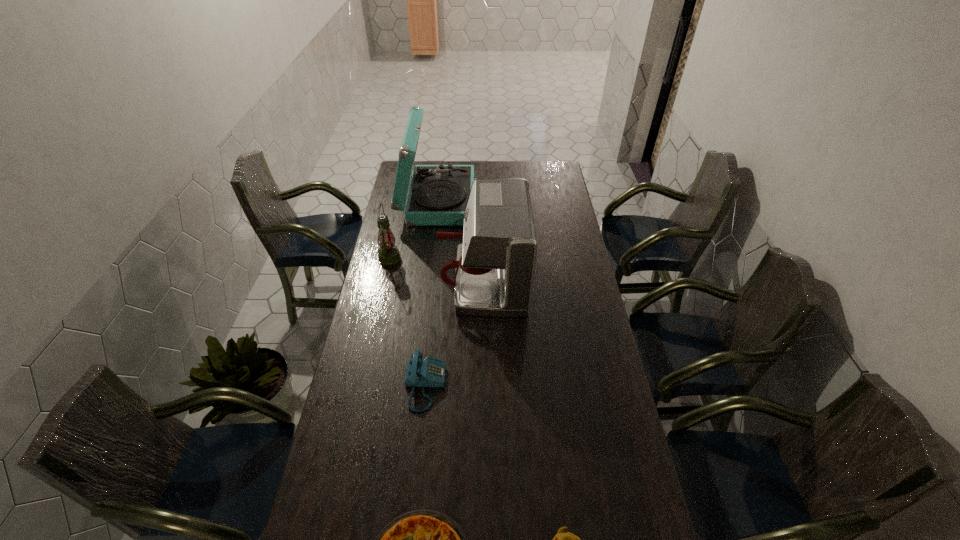
Locate an element on the screen. The width and height of the screenshot is (960, 540). vacant space positioned on the dial of the telephone is located at coordinates (484, 386).

The width and height of the screenshot is (960, 540). In order to click on object that is at the far edge in this screenshot , I will do `click(438, 194)`.

I want to click on record player present at the left edge, so [x=438, y=194].

Where is `oil lamp at the left edge`? This screenshot has height=540, width=960. oil lamp at the left edge is located at coordinates (388, 253).

I want to click on object located in the far left corner section of the desktop, so click(x=438, y=194).

Identify the location of vacant space at the far edge of the desktop. (433, 161).

You are a GUI agent. You are given a task and a screenshot of the screen. Output one action in this format:
    pyautogui.click(x=<x>, y=<y>)
    Task: Click on the vacant area at the left edge of the desktop
    
    Given the screenshot: What is the action you would take?
    pyautogui.click(x=393, y=340)

Find the location of a particular element. free space at the right edge of the desktop is located at coordinates (539, 197).

In order to click on free space between the coffee maker and the record player in this screenshot , I will do `click(461, 241)`.

Find the location of `vacant point located between the third nearest object and the record player`. vacant point located between the third nearest object and the record player is located at coordinates (432, 293).